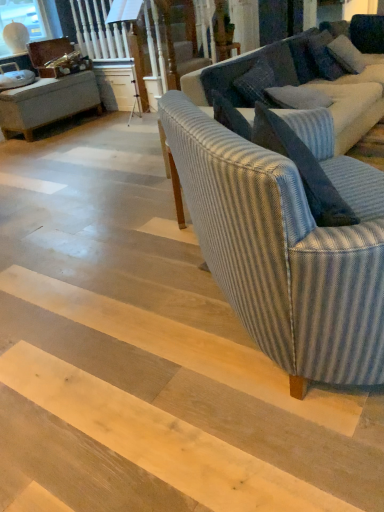
Find the location of a particular element. Image resolution: width=384 pixels, height=512 pixels. blue striped pillow at upper right, acting as the 2th pillow starting from the back is located at coordinates (298, 97).

This screenshot has height=512, width=384. Describe the element at coordinates (302, 84) in the screenshot. I see `striped fabric couch at center, placed as the 1th studio couch when sorted from back to front` at that location.

The width and height of the screenshot is (384, 512). What do you see at coordinates (285, 248) in the screenshot?
I see `striped fabric couch at center, which ranks as the second studio couch in back-to-front order` at bounding box center [285, 248].

What do you see at coordinates (346, 55) in the screenshot? The width and height of the screenshot is (384, 512). I see `dark gray textured pillow at upper right, positioned as the 2th pillow in front-to-back order` at bounding box center [346, 55].

You are a GUI agent. You are given a task and a screenshot of the screen. Output one action in this format:
    pyautogui.click(x=<x>, y=<y>)
    Task: Click on the dark gray textured pillow at upper right, positioned as the 2th pillow in front-to-back order
    
    Given the screenshot: What is the action you would take?
    pyautogui.click(x=346, y=55)

You are a GUI agent. You are given a task and a screenshot of the screen. Output one action in this format:
    pyautogui.click(x=<x>, y=<y>)
    Task: Click on the blue striped pillow at upper right, positioned as the 1th pillow in bottom-to-top order
    The image size is (384, 512).
    Given the screenshot: What is the action you would take?
    pyautogui.click(x=298, y=97)

From a real-world perspective, is striped fabric couch at center, placed as the 1th studio couch when sorted from back to front, positioned over dark gray textured pillow at upper right, the 2th pillow from the left, based on gravity?

No, from a real-world perspective, striped fabric couch at center, placed as the 1th studio couch when sorted from back to front, is not over dark gray textured pillow at upper right, the 2th pillow from the left

Can you confirm if striped fabric couch at center, placed as the 1th studio couch when sorted from back to front, is positioned to the left of dark gray textured pillow at upper right, positioned as the 2th pillow in front-to-back order?

Indeed, striped fabric couch at center, placed as the 1th studio couch when sorted from back to front, is positioned on the left side of dark gray textured pillow at upper right, positioned as the 2th pillow in front-to-back order.

Which of these two, striped fabric couch at center, arranged as the 2th studio couch when viewed from the front, or dark gray textured pillow at upper right, which ranks as the first pillow in top-to-bottom order, is smaller?

dark gray textured pillow at upper right, which ranks as the first pillow in top-to-bottom order.

Where is `the 2nd pillow above when counting from the striped fabric couch at center, which ranks as the second studio couch in back-to-front order (from the image's perspective)`? This screenshot has width=384, height=512. the 2nd pillow above when counting from the striped fabric couch at center, which ranks as the second studio couch in back-to-front order (from the image's perspective) is located at coordinates (346, 55).

Can you confirm if striped fabric couch at center, which ranks as the second studio couch in back-to-front order, is taller than dark gray textured pillow at upper right, the 1th pillow viewed from the right?

Yes.

Which of these two, striped fabric couch at center, arranged as the first studio couch when viewed from the front, or dark gray textured pillow at upper right, the 1th pillow viewed from the right, is thinner?

dark gray textured pillow at upper right, the 1th pillow viewed from the right, is thinner.

From a real-world perspective, which object rests below the other?

striped fabric couch at center, arranged as the 2th studio couch when viewed from the front, from a real-world perspective.

Which of these two, striped fabric couch at center, arranged as the 2th studio couch when viewed from the front, or blue striped pillow at upper right, acting as the 2th pillow starting from the back, is smaller?

blue striped pillow at upper right, acting as the 2th pillow starting from the back.

From a real-world perspective, which is physically above, blue striped pillow at upper right, acting as the 2th pillow starting from the top, or striped fabric couch at center, arranged as the 2th studio couch when viewed from the front?

blue striped pillow at upper right, acting as the 2th pillow starting from the top, is physically above.

Which object is positioned more to the right, blue striped pillow at upper right, acting as the 2th pillow starting from the top, or striped fabric couch at center, placed as the 1th studio couch when sorted from back to front?

From the viewer's perspective, striped fabric couch at center, placed as the 1th studio couch when sorted from back to front, appears more on the right side.

Are blue striped pillow at upper right, acting as the 2th pillow starting from the back, and striped fabric couch at center, arranged as the 2th studio couch when viewed from the front, making contact?

They are not placed beside each other.

Can you confirm if dark gray textured pillow at upper right, the 2th pillow from the left, is shorter than striped fabric couch at center, placed as the 1th studio couch when sorted from back to front?

Indeed, dark gray textured pillow at upper right, the 2th pillow from the left, has a lesser height compared to striped fabric couch at center, placed as the 1th studio couch when sorted from back to front.

Is dark gray textured pillow at upper right, which is counted as the first pillow, starting from the back, positioned with its back to striped fabric couch at center, arranged as the 2th studio couch when viewed from the front?

That's right, dark gray textured pillow at upper right, which is counted as the first pillow, starting from the back, is facing away from striped fabric couch at center, arranged as the 2th studio couch when viewed from the front.

Can you confirm if dark gray textured pillow at upper right, the 2th pillow from the left, is thinner than striped fabric couch at center, placed as the 1th studio couch when sorted from back to front?

Indeed, dark gray textured pillow at upper right, the 2th pillow from the left, has a lesser width compared to striped fabric couch at center, placed as the 1th studio couch when sorted from back to front.

Considering the positions of point (351, 63) and point (237, 76), is point (351, 63) closer or farther from the camera than point (237, 76)?

Point (351, 63) appears to be farther away from the viewer than point (237, 76).

Does striped fabric couch at center, placed as the 1th studio couch when sorted from back to front, have a greater height compared to striped fabric couch at center, arranged as the first studio couch when viewed from the front?

No.

From the picture: Which of these two, striped fabric couch at center, placed as the 1th studio couch when sorted from back to front, or striped fabric couch at center, which ranks as the second studio couch in back-to-front order, is wider?

With larger width is striped fabric couch at center, placed as the 1th studio couch when sorted from back to front.

Is striped fabric couch at center, placed as the 1th studio couch when sorted from back to front, at the right side of striped fabric couch at center, which ranks as the second studio couch in back-to-front order?

Correct, you'll find striped fabric couch at center, placed as the 1th studio couch when sorted from back to front, to the right of striped fabric couch at center, which ranks as the second studio couch in back-to-front order.

Is dark gray textured pillow at upper right, the 2th pillow from the left, beside striped fabric couch at center, arranged as the first studio couch when viewed from the front?

dark gray textured pillow at upper right, the 2th pillow from the left, and striped fabric couch at center, arranged as the first studio couch when viewed from the front, are not in contact.

From the image's perspective, which one is positioned higher, dark gray textured pillow at upper right, the 2th pillow from the left, or striped fabric couch at center, arranged as the first studio couch when viewed from the front?

dark gray textured pillow at upper right, the 2th pillow from the left.

Considering the relative sizes of dark gray textured pillow at upper right, the 1th pillow viewed from the right, and striped fabric couch at center, which ranks as the second studio couch in back-to-front order, in the image provided, is dark gray textured pillow at upper right, the 1th pillow viewed from the right, wider than striped fabric couch at center, which ranks as the second studio couch in back-to-front order,?

In fact, dark gray textured pillow at upper right, the 1th pillow viewed from the right, might be narrower than striped fabric couch at center, which ranks as the second studio couch in back-to-front order.

From the dark gray textured pillow at upper right, which is counted as the first pillow, starting from the back, count 1st studio couchs forward and point to it. Please provide its 2D coordinates.

[(302, 84)]

Locate an element on the screen. studio couch that is the 2nd object located below the dark gray textured pillow at upper right, which is the second pillow from bottom to top (from the image's perspective) is located at coordinates (285, 248).

Consider the image. Estimate the real-world distances between objects in this image. Which object is further from dark gray textured pillow at upper right, the 1th pillow viewed from the right, striped fabric couch at center, arranged as the first studio couch when viewed from the front, or striped fabric couch at center, arranged as the 2th studio couch when viewed from the front?

The object further to dark gray textured pillow at upper right, the 1th pillow viewed from the right, is striped fabric couch at center, arranged as the first studio couch when viewed from the front.

Which object lies nearer to the anchor point blue striped pillow at upper right, arranged as the second pillow when viewed from the right, striped fabric couch at center, arranged as the 2th studio couch when viewed from the front, or striped fabric couch at center, arranged as the first studio couch when viewed from the front?

The object closer to blue striped pillow at upper right, arranged as the second pillow when viewed from the right, is striped fabric couch at center, arranged as the 2th studio couch when viewed from the front.

Considering their positions, is striped fabric couch at center, arranged as the 2th studio couch when viewed from the front, positioned closer to blue striped pillow at upper right, which ranks as the first pillow in left-to-right order, than dark gray textured pillow at upper right, positioned as the 2th pillow in front-to-back order?

striped fabric couch at center, arranged as the 2th studio couch when viewed from the front, lies closer to blue striped pillow at upper right, which ranks as the first pillow in left-to-right order, than the other object.

When comparing their distances from striped fabric couch at center, arranged as the 2th studio couch when viewed from the front, does striped fabric couch at center, arranged as the first studio couch when viewed from the front, or dark gray textured pillow at upper right, the 2th pillow from the left, seem further?

Among the two, striped fabric couch at center, arranged as the first studio couch when viewed from the front, is located further to striped fabric couch at center, arranged as the 2th studio couch when viewed from the front.

Looking at the image, which one is located closer to dark gray textured pillow at upper right, positioned as the 2th pillow in front-to-back order, blue striped pillow at upper right, positioned as the 1th pillow in bottom-to-top order, or striped fabric couch at center, arranged as the first studio couch when viewed from the front?

Among the two, blue striped pillow at upper right, positioned as the 1th pillow in bottom-to-top order, is located nearer to dark gray textured pillow at upper right, positioned as the 2th pillow in front-to-back order.

Considering their positions, is blue striped pillow at upper right, acting as the 2th pillow starting from the back, positioned further to striped fabric couch at center, which ranks as the second studio couch in back-to-front order, than striped fabric couch at center, arranged as the 2th studio couch when viewed from the front?

striped fabric couch at center, arranged as the 2th studio couch when viewed from the front, lies further to striped fabric couch at center, which ranks as the second studio couch in back-to-front order, than the other object.

When comparing their distances from dark gray textured pillow at upper right, which is the second pillow from bottom to top, does striped fabric couch at center, arranged as the 2th studio couch when viewed from the front, or striped fabric couch at center, which ranks as the second studio couch in back-to-front order, seem further?

striped fabric couch at center, which ranks as the second studio couch in back-to-front order.

Based on their spatial positions, is dark gray textured pillow at upper right, the 2th pillow from the left, or striped fabric couch at center, arranged as the first studio couch when viewed from the front, further from striped fabric couch at center, placed as the 1th studio couch when sorted from back to front?

Among the two, striped fabric couch at center, arranged as the first studio couch when viewed from the front, is located further to striped fabric couch at center, placed as the 1th studio couch when sorted from back to front.

Where is `pillow between striped fabric couch at center, arranged as the first studio couch when viewed from the front, and dark gray textured pillow at upper right, which ranks as the first pillow in top-to-bottom order, from front to back`? Image resolution: width=384 pixels, height=512 pixels. pillow between striped fabric couch at center, arranged as the first studio couch when viewed from the front, and dark gray textured pillow at upper right, which ranks as the first pillow in top-to-bottom order, from front to back is located at coordinates (298, 97).

Identify the location of studio couch located between striped fabric couch at center, which ranks as the second studio couch in back-to-front order, and dark gray textured pillow at upper right, which is counted as the first pillow, starting from the back, in the depth direction. (302, 84).

At what (x,y) coordinates should I click in order to perform the action: click on pillow between striped fabric couch at center, placed as the 1th studio couch when sorted from back to front, and dark gray textured pillow at upper right, the 2th pillow from the left, from front to back. Please return your answer as a coordinate pair (x, y). Looking at the image, I should click on (298, 97).

Find the location of a particular element. The image size is (384, 512). studio couch between striped fabric couch at center, arranged as the first studio couch when viewed from the front, and blue striped pillow at upper right, arranged as the second pillow when viewed from the right, from front to back is located at coordinates (302, 84).